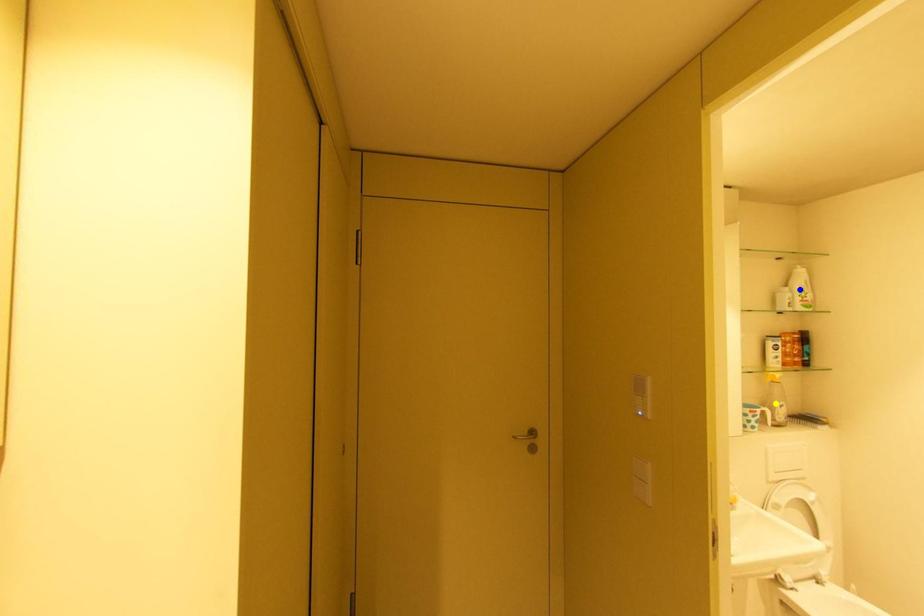
From the picture: Order these from farthest to nearest:
1. blue point
2. orange point
3. yellow point

yellow point, blue point, orange point